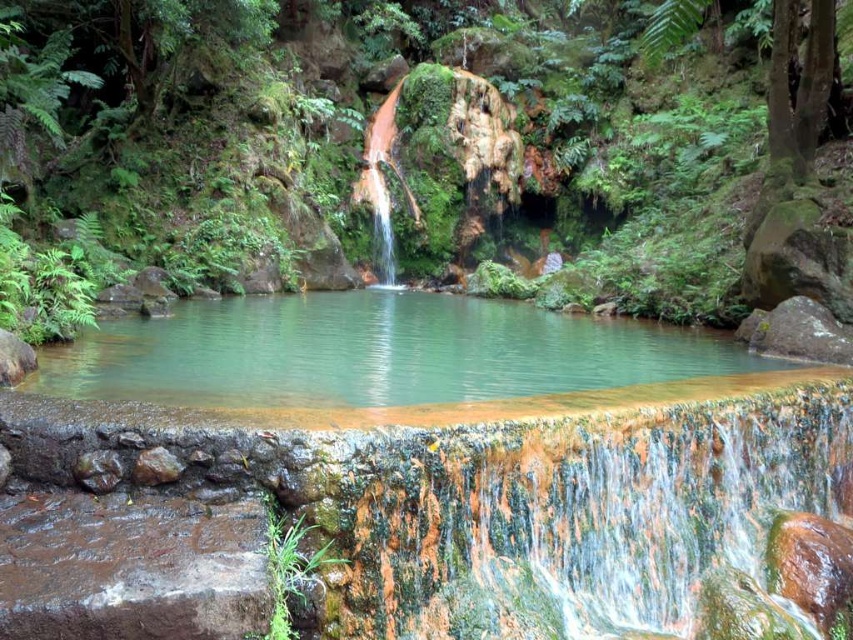
Question: Is green mossy rock at center further to the viewer compared to clear water at center?

Choices:
 (A) no
 (B) yes

Answer: (B)

Question: Can you confirm if green mossy rock at center is positioned to the left of translucent glass waterfall at center?

Choices:
 (A) no
 (B) yes

Answer: (A)

Question: Which point appears closest to the camera in this image?

Choices:
 (A) (343, 296)
 (B) (706, 195)
 (C) (370, 161)

Answer: (B)

Question: Which of the following is the closest to the observer?

Choices:
 (A) translucent glass waterfall at center
 (B) clear water at center
 (C) green mossy rock at center

Answer: (B)

Question: Which object appears farthest from the camera in this image?

Choices:
 (A) clear water at center
 (B) translucent glass waterfall at center
 (C) green mossy rock at center

Answer: (B)

Question: Does green mossy rock at center have a smaller size compared to translucent glass waterfall at center?

Choices:
 (A) yes
 (B) no

Answer: (B)